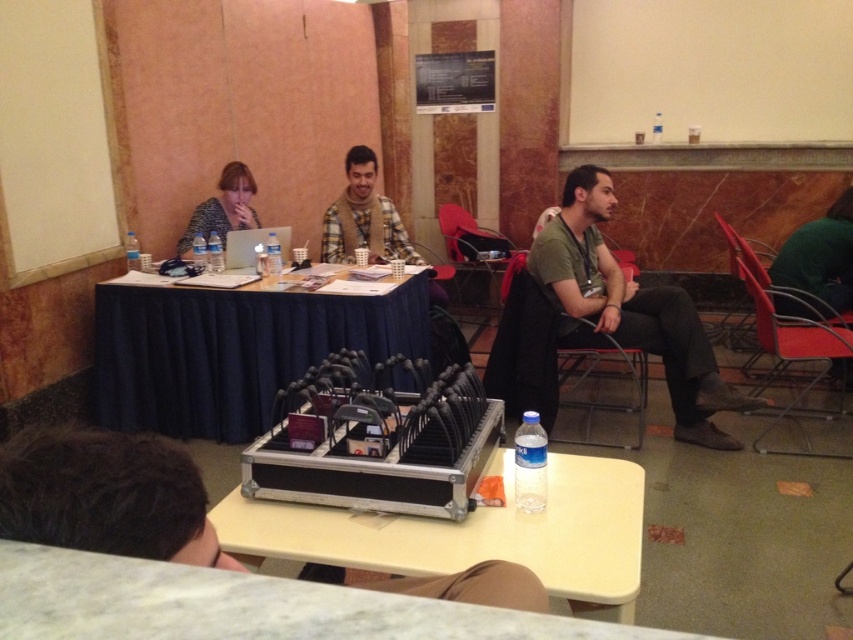
Between point (393, 337) and point (323, 225), which one is positioned in front?

Point (393, 337) is in front.

Can you confirm if blue fabric table at center is bigger than plaid fabric shirt at center?

Yes.

Identify the location of blue fabric table at center. Image resolution: width=853 pixels, height=640 pixels. (231, 349).

Is green cotton shirt at center shorter than plaid fabric shirt at center?

Incorrect, green cotton shirt at center's height does not fall short of plaid fabric shirt at center's.

Is point (697, 324) farther from viewer compared to point (364, 179)?

No, (697, 324) is in front of (364, 179).

Describe the element at coordinates (628, 308) in the screenshot. The height and width of the screenshot is (640, 853). I see `green cotton shirt at center` at that location.

Locate an element on the screen. The width and height of the screenshot is (853, 640). green cotton shirt at center is located at coordinates (628, 308).

Between point (97, 342) and point (593, 244), which one is positioned in front?

Positioned in front is point (97, 342).

Is point (187, 365) behind point (572, 294)?

Yes, it is behind point (572, 294).

Where is `blue fabric table at center`? The image size is (853, 640). blue fabric table at center is located at coordinates pyautogui.click(x=231, y=349).